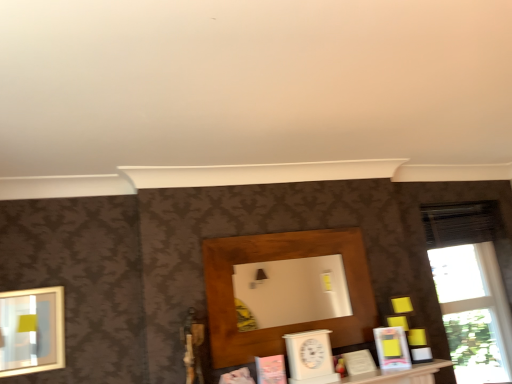
Where is `vacant space situated above white wooden clock at lower center (from a real-world perspective)`? Image resolution: width=512 pixels, height=384 pixels. vacant space situated above white wooden clock at lower center (from a real-world perspective) is located at coordinates (302, 330).